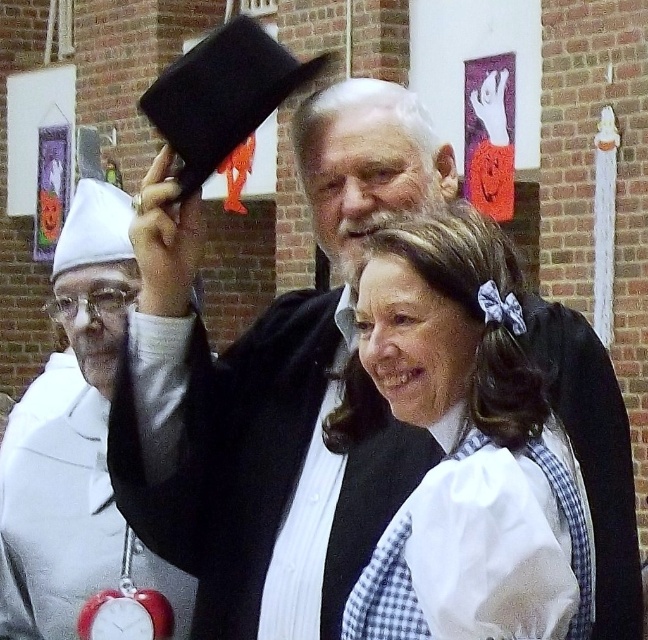
Question: Which point appears closest to the camera in this image?

Choices:
 (A) [91, 364]
 (B) [463, 278]
 (C) [340, 502]

Answer: (B)

Question: Is matte black hat at upper center below white gingham dress at center?

Choices:
 (A) no
 (B) yes

Answer: (A)

Question: Which point is closer to the camera?

Choices:
 (A) (60, 493)
 (B) (450, 488)

Answer: (B)

Question: Can you confirm if matte black hat at upper center is smaller than white cloth hat at left?

Choices:
 (A) no
 (B) yes

Answer: (B)

Question: Is matte black hat at upper center bigger than white gingham dress at center?

Choices:
 (A) no
 (B) yes

Answer: (B)

Question: Which object is the farthest from the white cloth hat at left?

Choices:
 (A) white gingham dress at center
 (B) matte black hat at upper center

Answer: (A)